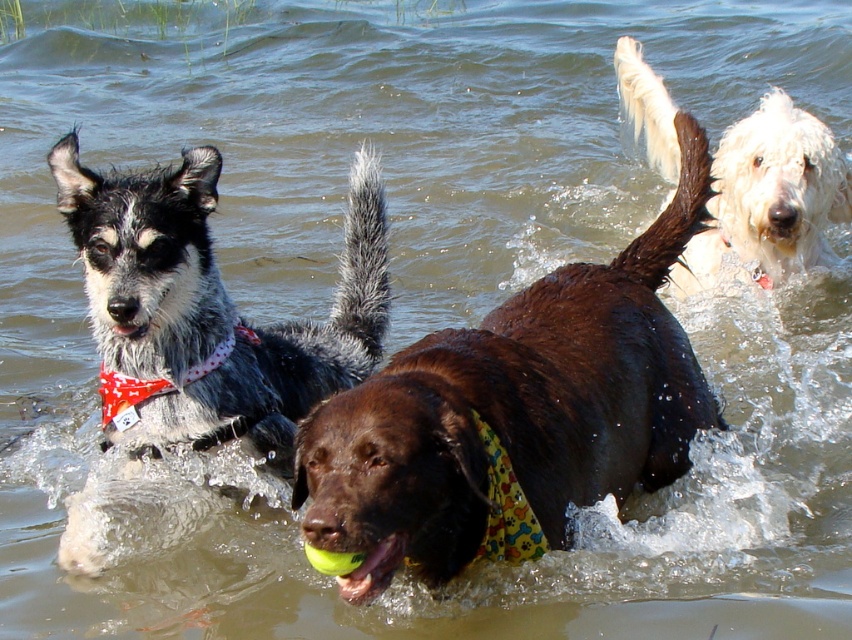
Looking at this image, you are a photographer trying to capture a photo of the spotted fur dog at left and the yellow rubber ball at center. Based on their positions, which object should you focus on first if you want to include both in the frame without moving the camera?

The spotted fur dog at left is to the left of the yellow rubber ball at center, so you should focus on the spotted fur dog at left first to ensure both are in the frame.

You are a photographer trying to capture the spotted fur dog at left in the image. The coordinates provided are point (210, 310). Based on the scene description, where exactly is this point located on the spotted fur dog at left?

The point (210, 310) is located on the spotted fur dog at left.

You are standing at the center of the image and want to throw a ball to the brown shiny dog at center. In which direction should you throw the ball to reach the dog?

The brown shiny dog at center is located at point (517, 410), so you should throw the ball towards the lower right direction to reach the dog.